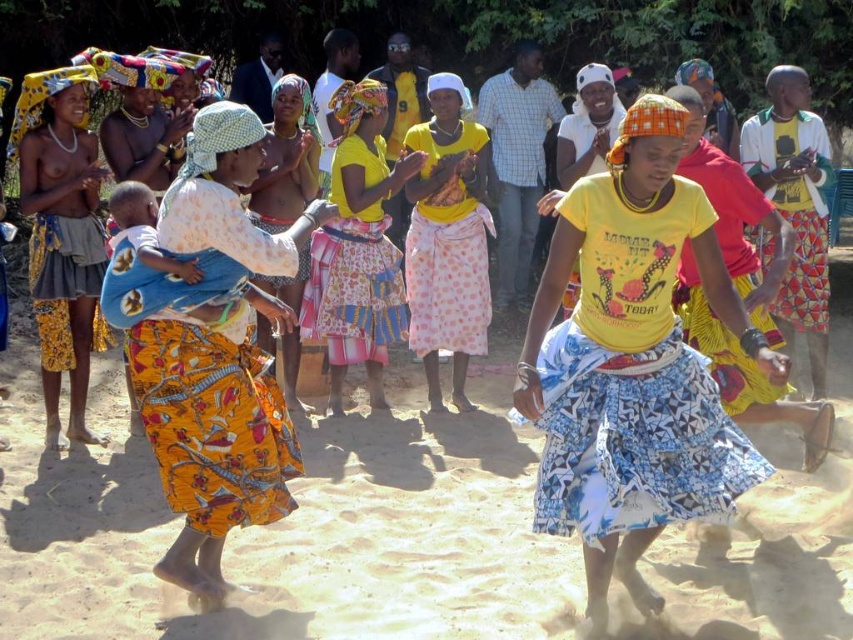
Does yellow printed fabric skirt at center appear on the right side of matte yellow fabric skirt at left?

Correct, you'll find yellow printed fabric skirt at center to the right of matte yellow fabric skirt at left.

Is the position of yellow printed fabric skirt at center less distant than that of matte yellow fabric skirt at left?

That is True.

Who is more distant from viewer, [267,358] or [59,380]?

Positioned behind is point [59,380].

The image size is (853, 640). I want to click on yellow printed fabric skirt at center, so click(218, 355).

Is yellow printed t-shirt at center closer to camera compared to yellow printed shirt at center?

Yes.

In the scene shown: Between yellow printed t-shirt at center and yellow printed shirt at center, which one is positioned lower?

yellow printed t-shirt at center is lower down.

Measure the distance between point (682, 508) and camera.

They are 13.24 feet apart.

This screenshot has height=640, width=853. I want to click on yellow printed t-shirt at center, so click(631, 364).

Does matte yellow fabric skirt at left appear on the left side of yellow printed fabric at center?

Correct, you'll find matte yellow fabric skirt at left to the left of yellow printed fabric at center.

Between matte yellow fabric skirt at left and yellow printed fabric at center, which one is positioned higher?

yellow printed fabric at center

Is point (45, 212) positioned before point (280, 100)?

Yes, point (45, 212) is closer to viewer.

Identify the location of matte yellow fabric skirt at left. (61, 234).